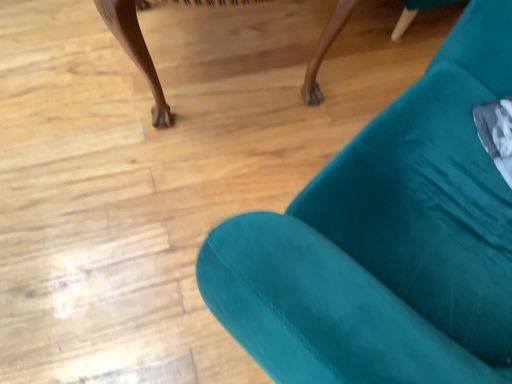
Describe the element at coordinates (136, 50) in the screenshot. This screenshot has width=512, height=384. I see `teal fabric chair at lower right` at that location.

Measure the distance between teal fabric chair at lower right and camera.

3.75 feet.

The image size is (512, 384). Identify the location of teal fabric chair at lower right. (136, 50).

In order to face teal fabric chair at lower right, should I rotate leftwards or rightwards?

You should look left and rotate roughly 4.409 degrees.

Locate an element on the screen. The image size is (512, 384). velvet teal armchair at upper right is located at coordinates (387, 241).

What do you see at coordinates (387, 241) in the screenshot?
I see `velvet teal armchair at upper right` at bounding box center [387, 241].

Locate an element on the screen. The image size is (512, 384). teal fabric chair at lower right is located at coordinates [136, 50].

Based on their positions, is teal fabric chair at lower right located to the left or right of velvet teal armchair at upper right?

Clearly, teal fabric chair at lower right is on the left of velvet teal armchair at upper right in the image.

Does teal fabric chair at lower right come behind velvet teal armchair at upper right?

Yes, teal fabric chair at lower right is further from the viewer.

Is point (105, 18) positioned behind point (307, 230)?

Yes, it is.

From the image's perspective, between teal fabric chair at lower right and velvet teal armchair at upper right, which one is located above?

From the image's view, teal fabric chair at lower right is above.

From a real-world perspective, is teal fabric chair at lower right positioned under velvet teal armchair at upper right based on gravity?

Yes.

From the picture: In terms of width, does teal fabric chair at lower right look wider or thinner when compared to velvet teal armchair at upper right?

In the image, teal fabric chair at lower right appears to be wider than velvet teal armchair at upper right.

Does teal fabric chair at lower right have a lesser height compared to velvet teal armchair at upper right?

Yes, teal fabric chair at lower right is shorter than velvet teal armchair at upper right.

Considering the sizes of objects teal fabric chair at lower right and velvet teal armchair at upper right in the image provided, who is bigger, teal fabric chair at lower right or velvet teal armchair at upper right?

velvet teal armchair at upper right is bigger.

Is teal fabric chair at lower right outside of velvet teal armchair at upper right?

Yes, teal fabric chair at lower right is not within velvet teal armchair at upper right.

Is teal fabric chair at lower right in contact with velvet teal armchair at upper right?

They are not placed beside each other.

Is teal fabric chair at lower right aimed at velvet teal armchair at upper right?

Yes, teal fabric chair at lower right is oriented towards velvet teal armchair at upper right.

Can you tell me how much teal fabric chair at lower right and velvet teal armchair at upper right differ in facing direction?

teal fabric chair at lower right and velvet teal armchair at upper right are facing 150 degrees away from each other.

How distant is teal fabric chair at lower right from velvet teal armchair at upper right?

A distance of 25.42 inches exists between teal fabric chair at lower right and velvet teal armchair at upper right.

You are a GUI agent. You are given a task and a screenshot of the screen. Output one action in this format:
    pyautogui.click(x=<x>, y=<y>)
    Task: Click on the furniture below the velvet teal armchair at upper right (from a real-world perspective)
    The width and height of the screenshot is (512, 384).
    Given the screenshot: What is the action you would take?
    pyautogui.click(x=136, y=50)

Does velvet teal armchair at upper right appear on the left side of teal fabric chair at lower right?

No, velvet teal armchair at upper right is not to the left of teal fabric chair at lower right.

Which object is further away from the camera taking this photo, velvet teal armchair at upper right or teal fabric chair at lower right?

teal fabric chair at lower right.

Is point (238, 245) farther from camera compared to point (153, 117)?

No, it is in front of (153, 117).

From the image's perspective, which one is positioned lower, velvet teal armchair at upper right or teal fabric chair at lower right?

velvet teal armchair at upper right.

From a real-world perspective, is velvet teal armchair at upper right positioned above or below teal fabric chair at lower right?

Clearly, from a real-world perspective, velvet teal armchair at upper right is above teal fabric chair at lower right.

Which of these two, velvet teal armchair at upper right or teal fabric chair at lower right, is wider?

Wider between the two is teal fabric chair at lower right.

In the scene shown: Considering the sizes of velvet teal armchair at upper right and teal fabric chair at lower right in the image, is velvet teal armchair at upper right taller or shorter than teal fabric chair at lower right?

velvet teal armchair at upper right is taller than teal fabric chair at lower right.

Considering the sizes of velvet teal armchair at upper right and teal fabric chair at lower right in the image, is velvet teal armchair at upper right bigger or smaller than teal fabric chair at lower right?

In the image, velvet teal armchair at upper right appears to be larger than teal fabric chair at lower right.

Consider the image. Is velvet teal armchair at upper right not inside teal fabric chair at lower right?

Absolutely, velvet teal armchair at upper right is external to teal fabric chair at lower right.

Is velvet teal armchair at upper right far from teal fabric chair at lower right?

velvet teal armchair at upper right is actually quite close to teal fabric chair at lower right.

Is velvet teal armchair at upper right facing towards teal fabric chair at lower right?

Yes, velvet teal armchair at upper right is oriented towards teal fabric chair at lower right.

How different are the orientations of velvet teal armchair at upper right and teal fabric chair at lower right in degrees?

There is a 150-degree angle between the facing directions of velvet teal armchair at upper right and teal fabric chair at lower right.

At what (x,y) coordinates should I click in order to perform the action: click on furniture that is behind the velvet teal armchair at upper right. Please return your answer as a coordinate pair (x, y). The image size is (512, 384). Looking at the image, I should click on (136, 50).

Where is `furniture below the velvet teal armchair at upper right (from a real-world perspective)`? Image resolution: width=512 pixels, height=384 pixels. furniture below the velvet teal armchair at upper right (from a real-world perspective) is located at coordinates 136,50.

Find the location of a particular element. The image size is (512, 384). furniture on the left of velvet teal armchair at upper right is located at coordinates (136, 50).